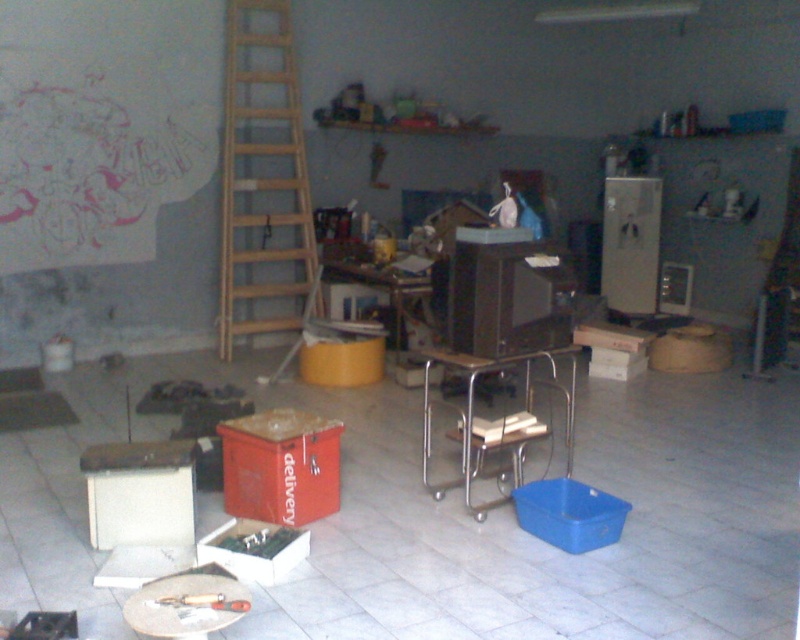
Question: Which point is closer to the camera taking this photo?

Choices:
 (A) (468, 371)
 (B) (236, 572)
 (C) (594, 504)
 (D) (282, 132)

Answer: (B)

Question: Can you confirm if metallic silver cart at center is positioned to the left of metallic red tool at lower center?

Choices:
 (A) yes
 (B) no

Answer: (B)

Question: Which object is the farthest from the metallic red tool at lower center?

Choices:
 (A) blue plastic bucket at lower right
 (B) metallic silver cart at center
 (C) white cardboard box at lower center

Answer: (B)

Question: Is wooden ladder at center-left thinner than metallic red tool at lower center?

Choices:
 (A) no
 (B) yes

Answer: (A)

Question: Where is blue plastic bucket at lower right located in relation to metallic red tool at lower center in the image?

Choices:
 (A) below
 (B) above

Answer: (B)

Question: Which of the following is the farthest from the observer?

Choices:
 (A) metallic silver cart at center
 (B) orange cardboard delivery box at center

Answer: (A)